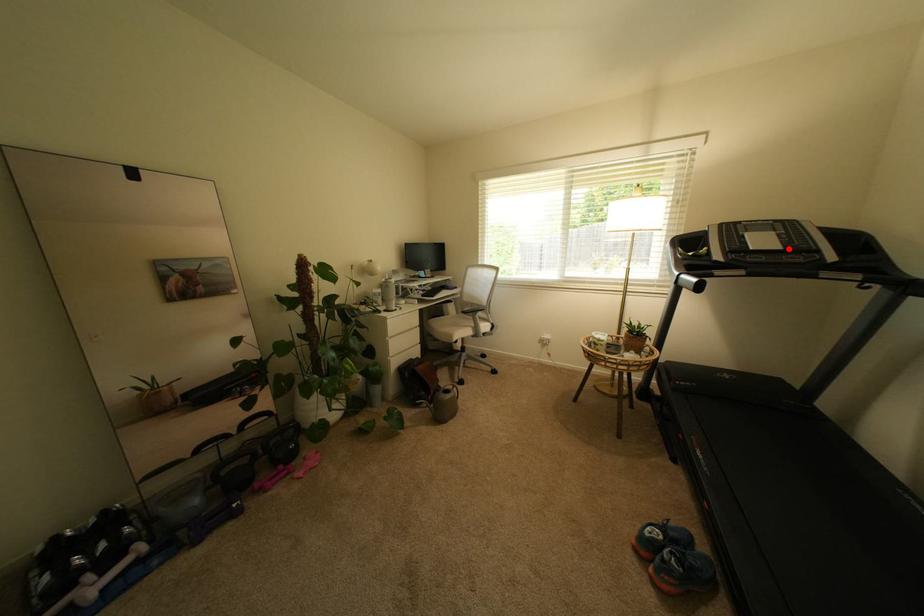
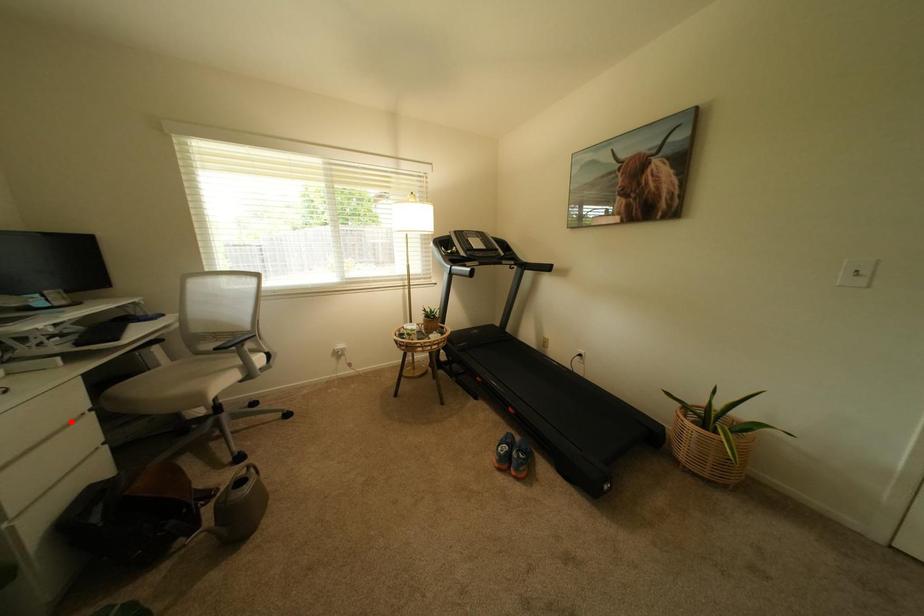
I am providing you with two images of the same scene from different viewpoints. A red point is marked on the first image and another point is marked on the second image. Is the marked point in image1 the same physical position as the marked point in image2?

No